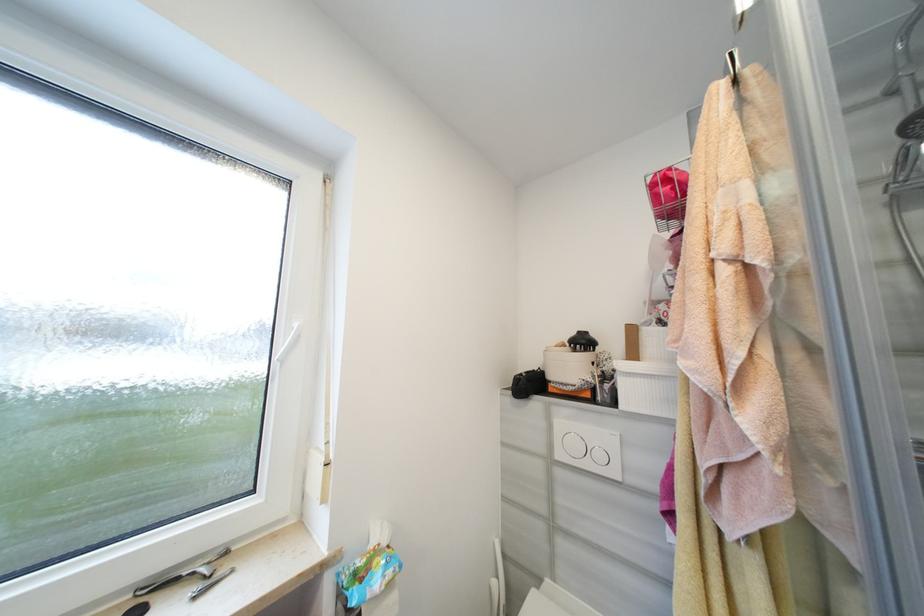
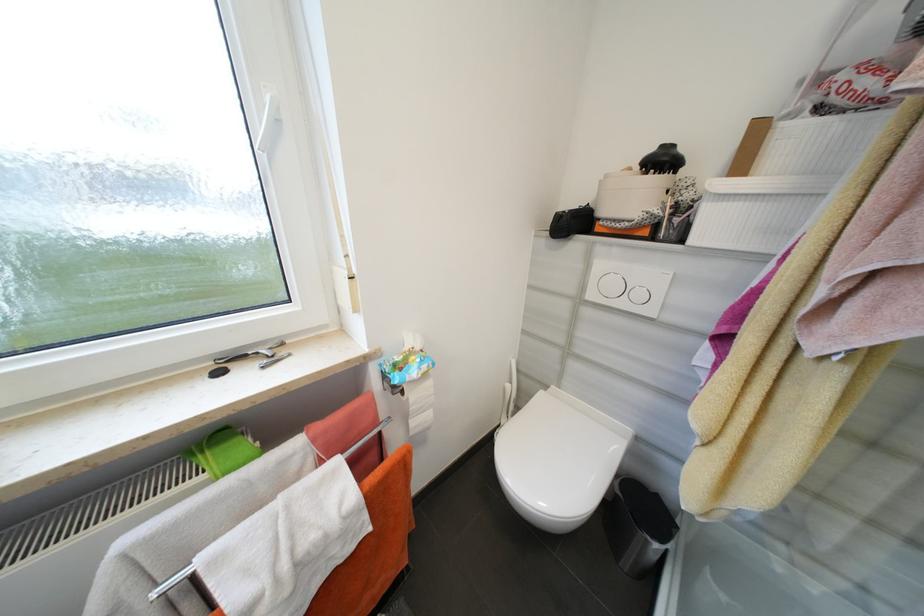
Where in the second image is the point corresponding to point (500, 583) from the first image?

(514, 387)